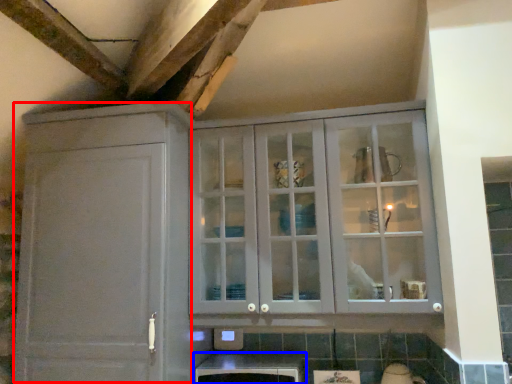
Question: Which of the following is the closest to the observer, cabinetry (highlighted by a red box) or cabinetry (highlighted by a blue box)?

Choices:
 (A) cabinetry
 (B) cabinetry

Answer: (A)